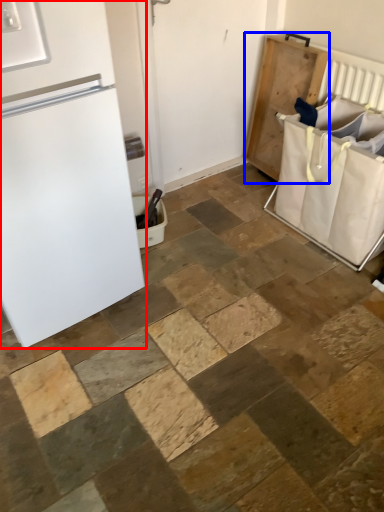
Question: Which point is closer to the camera, refrigerator (highlighted by a red box) or changing table (highlighted by a blue box)?

Choices:
 (A) refrigerator
 (B) changing table

Answer: (A)